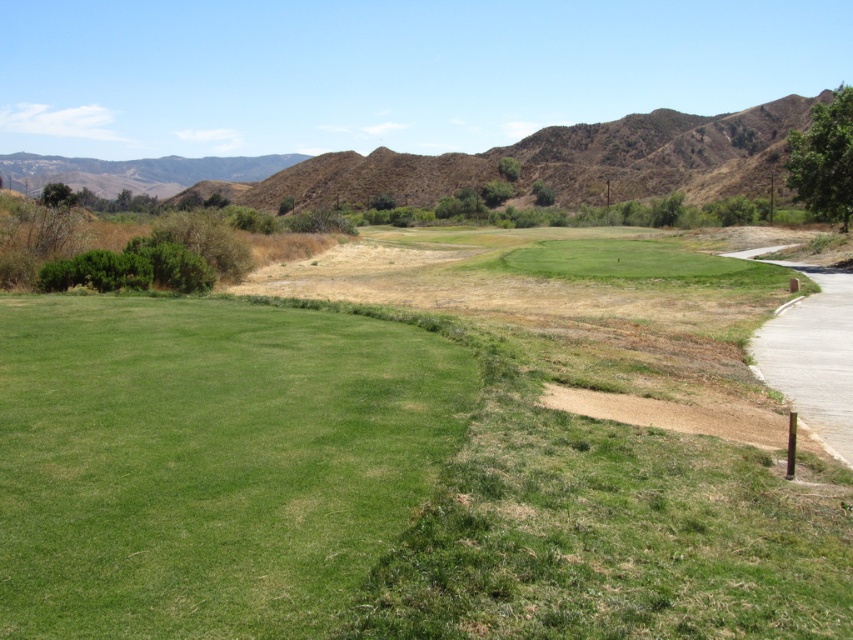
You are standing at the point labeled as point (416, 451) in the image. Based on the scene description, what type of terrain are you currently standing on?

The point (416, 451) is on green grassy golf course at center, so you are standing on a well maintained grassy area typical of a golf course.